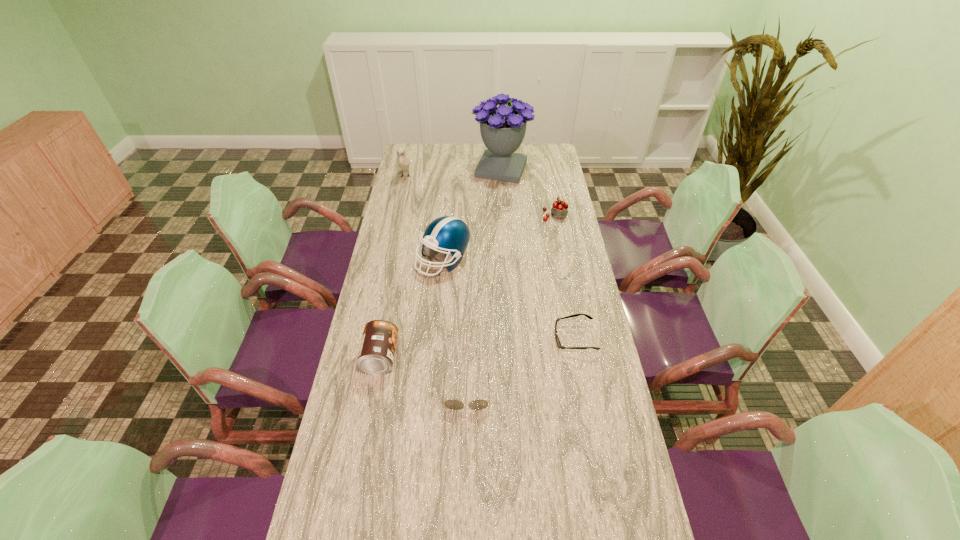
Where is `bouquet`? The image size is (960, 540). bouquet is located at coordinates (503, 128).

What are the coordinates of `football helmet` in the screenshot? It's located at (451, 235).

Find the location of a particular element. Image resolution: width=960 pixels, height=540 pixels. bird is located at coordinates (403, 162).

Locate an element on the screen. the third farthest object is located at coordinates (559, 210).

This screenshot has width=960, height=540. In order to click on can in this screenshot , I will do pos(376,353).

The width and height of the screenshot is (960, 540). What are the coordinates of `the taller sunglasses` in the screenshot? It's located at (452, 404).

In order to click on the second shortest object in this screenshot , I will do `click(452, 404)`.

Where is `the farther sunglasses`? The image size is (960, 540). the farther sunglasses is located at coordinates (558, 342).

Find the location of a particular element. The image size is (960, 540). the shorter sunglasses is located at coordinates (558, 342).

Where is `vacant position located on the front of the bouquet`? vacant position located on the front of the bouquet is located at coordinates (503, 192).